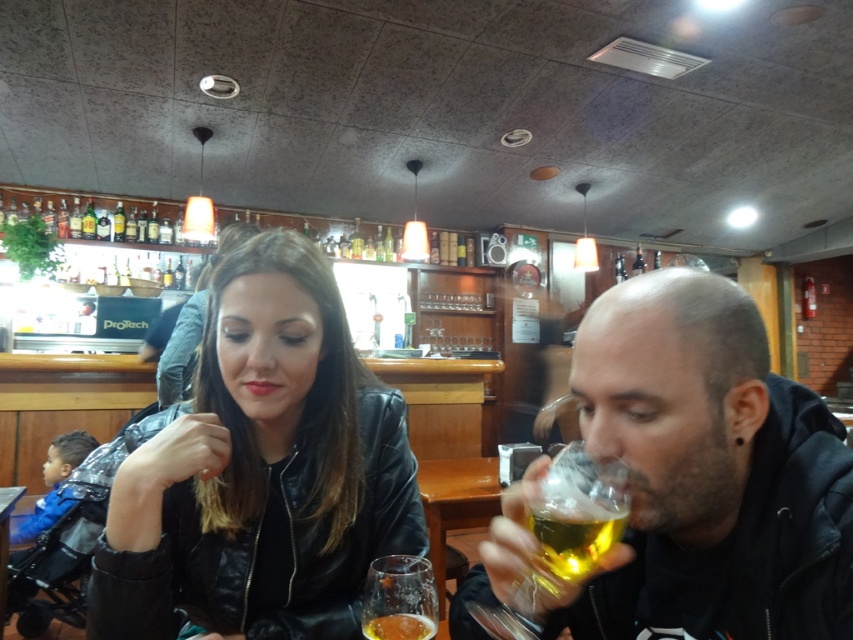
From the picture: You are a bartender who needs to place a new drink order on the counter. The drink must be placed to the right of the black leather jacket at center. Can you confirm if the translucent glass beer at lower center is already positioned correctly for the order?

The black leather jacket at center is to the left of the translucent glass beer at lower center, so yes, the translucent glass beer at lower center is already positioned to the right of the black leather jacket at center and meets the order requirement.

You are a bartender preparing to clean the glasses. You need to reach for the translucent glass beer at right and the translucent glass beer at lower center. Which one should you grab first to avoid knocking over the other?

You should grab the translucent glass beer at right first because it is in front of the translucent glass beer at lower center, so moving it first won